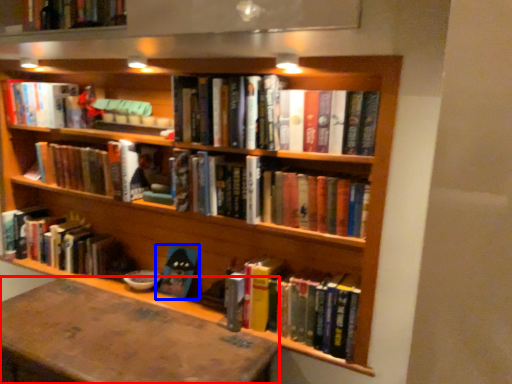
Question: Among these objects, which one is nearest to the camera, table (highlighted by a red box) or book (highlighted by a blue box)?

Choices:
 (A) table
 (B) book

Answer: (A)